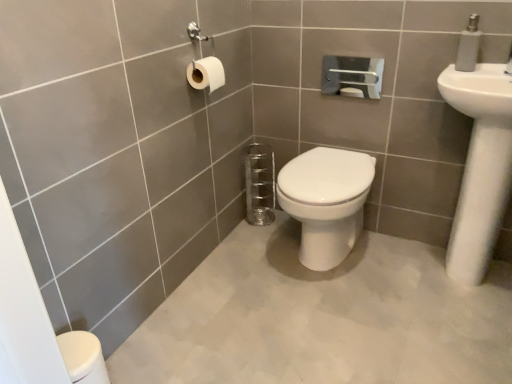
Where is `white glossy toilet at center`? white glossy toilet at center is located at coordinates (326, 201).

What do you see at coordinates (206, 74) in the screenshot? The width and height of the screenshot is (512, 384). I see `white matte toilet paper at upper left` at bounding box center [206, 74].

Identify the location of white plastic soap dispenser at upper right. (468, 46).

From a real-world perspective, who is located higher, white glossy sink at upper right or white plastic soap dispenser at upper right?

white plastic soap dispenser at upper right is physically above.

Considering the relative positions of white glossy sink at upper right and white plastic soap dispenser at upper right in the image provided, is white glossy sink at upper right in front of white plastic soap dispenser at upper right?

Yes, white glossy sink at upper right is closer to the camera.

Between white glossy sink at upper right and white plastic soap dispenser at upper right, which one has more height?

white glossy sink at upper right is taller.

Is white plastic soap dispenser at upper right completely or partially inside white glossy sink at upper right?

No, white plastic soap dispenser at upper right is not inside white glossy sink at upper right.

Considering the positions of objects white matte toilet paper at upper left and white glossy toilet at center in the image provided, who is in front, white matte toilet paper at upper left or white glossy toilet at center?

white glossy toilet at center is more forward.

Is white matte toilet paper at upper left oriented away from white glossy toilet at center?

That's not correct — white matte toilet paper at upper left is not looking away from white glossy toilet at center.

Between white matte toilet paper at upper left and white glossy toilet at center, which one appears on the left side from the viewer's perspective?

From the viewer's perspective, white matte toilet paper at upper left appears more on the left side.

Is white glossy toilet at center wider than white matte toilet paper at upper left?

Yes, white glossy toilet at center is wider than white matte toilet paper at upper left.

From their relative heights in the image, would you say white glossy toilet at center is taller or shorter than white matte toilet paper at upper left?

In the image, white glossy toilet at center appears to be taller than white matte toilet paper at upper left.

From a real-world perspective, is white glossy toilet at center above or below white matte toilet paper at upper left?

Clearly, from a real-world perspective, white glossy toilet at center is below white matte toilet paper at upper left.

In terms of size, does white plastic soap dispenser at upper right appear bigger or smaller than white matte toilet paper at upper left?

white plastic soap dispenser at upper right is bigger than white matte toilet paper at upper left.

Is white plastic soap dispenser at upper right at the right side of white matte toilet paper at upper left?

Yes.

Is white plastic soap dispenser at upper right thinner than white matte toilet paper at upper left?

No, white plastic soap dispenser at upper right is not thinner than white matte toilet paper at upper left.

Is white plastic soap dispenser at upper right oriented towards white matte toilet paper at upper left?

Result: No, white plastic soap dispenser at upper right is not turned towards white matte toilet paper at upper left.

This screenshot has height=384, width=512. Find the location of `soap dispenser above the white glossy sink at upper right (from the image's perspective)`. soap dispenser above the white glossy sink at upper right (from the image's perspective) is located at coordinates (468, 46).

In the scene shown: From the image's perspective, is white plastic soap dispenser at upper right on top of white glossy sink at upper right?

Yes.

Based on the photo, can you confirm if white plastic soap dispenser at upper right is smaller than white glossy sink at upper right?

Yes, white plastic soap dispenser at upper right is smaller than white glossy sink at upper right.

How different are the orientations of white plastic soap dispenser at upper right and white glossy sink at upper right in degrees?

The angle between the facing direction of white plastic soap dispenser at upper right and the facing direction of white glossy sink at upper right is 0.000605 degrees.

Is white matte toilet paper at upper left further to the viewer compared to white plastic soap dispenser at upper right?

Yes, white matte toilet paper at upper left is further from the camera.

Can you confirm if white matte toilet paper at upper left is smaller than white plastic soap dispenser at upper right?

Correct, white matte toilet paper at upper left occupies less space than white plastic soap dispenser at upper right.

Would you say white matte toilet paper at upper left contains white plastic soap dispenser at upper right?

No, white plastic soap dispenser at upper right is not a part of white matte toilet paper at upper left.

Considering the relative sizes of white glossy sink at upper right and white glossy toilet at center in the image provided, is white glossy sink at upper right bigger than white glossy toilet at center?

Indeed, white glossy sink at upper right has a larger size compared to white glossy toilet at center.

Considering the relative sizes of white glossy sink at upper right and white glossy toilet at center in the image provided, is white glossy sink at upper right taller than white glossy toilet at center?

Yes.

Is white glossy sink at upper right further to camera compared to white glossy toilet at center?

No, white glossy sink at upper right is in front of white glossy toilet at center.

What are the coordinates of `soap dispenser above the white glossy sink at upper right (from a real-world perspective)` in the screenshot? It's located at click(x=468, y=46).

Where is `toilet below the white matte toilet paper at upper left (from the image's perspective)`? toilet below the white matte toilet paper at upper left (from the image's perspective) is located at coordinates (326, 201).

Estimate the real-world distances between objects in this image. Which object is further from white matte toilet paper at upper left, white glossy sink at upper right or white glossy toilet at center?

white glossy sink at upper right is positioned further to the anchor white matte toilet paper at upper left.

Based on their spatial positions, is white plastic soap dispenser at upper right or white glossy toilet at center closer to white matte toilet paper at upper left?

white glossy toilet at center.

Estimate the real-world distances between objects in this image. Which object is closer to white glossy sink at upper right, white glossy toilet at center or white matte toilet paper at upper left?

white glossy toilet at center.

From the image, which object appears to be nearer to white glossy sink at upper right, white glossy toilet at center or white plastic soap dispenser at upper right?

white plastic soap dispenser at upper right.

Looking at this image, considering their positions, is white matte toilet paper at upper left positioned closer to white glossy toilet at center than white glossy sink at upper right?

white glossy sink at upper right is closer to white glossy toilet at center.

Which object lies further to the anchor point white matte toilet paper at upper left, white glossy toilet at center or white glossy sink at upper right?

Based on the image, white glossy sink at upper right appears to be further to white matte toilet paper at upper left.

Which object lies further to the anchor point white matte toilet paper at upper left, white glossy toilet at center or white plastic soap dispenser at upper right?

The object further to white matte toilet paper at upper left is white plastic soap dispenser at upper right.

From the image, which object appears to be nearer to white glossy sink at upper right, white matte toilet paper at upper left or white glossy toilet at center?

Based on the image, white glossy toilet at center appears to be nearer to white glossy sink at upper right.

Where is `toilet located between white matte toilet paper at upper left and white glossy sink at upper right in the left-right direction`? This screenshot has width=512, height=384. toilet located between white matte toilet paper at upper left and white glossy sink at upper right in the left-right direction is located at coordinates (326, 201).

At what (x,y) coordinates should I click in order to perform the action: click on soap dispenser between white matte toilet paper at upper left and white glossy sink at upper right from left to right. Please return your answer as a coordinate pair (x, y). Looking at the image, I should click on (468, 46).

Locate an element on the screen. This screenshot has width=512, height=384. toilet located between white matte toilet paper at upper left and white plastic soap dispenser at upper right in the left-right direction is located at coordinates (326, 201).

Identify the location of sink between white plastic soap dispenser at upper right and white glossy toilet at center from top to bottom. The image size is (512, 384). (480, 166).